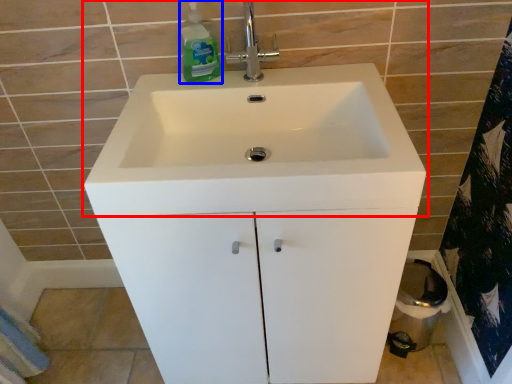
Question: Which object appears farthest to the camera in this image, sink (highlighted by a red box) or cleaning product (highlighted by a blue box)?

Choices:
 (A) sink
 (B) cleaning product

Answer: (B)